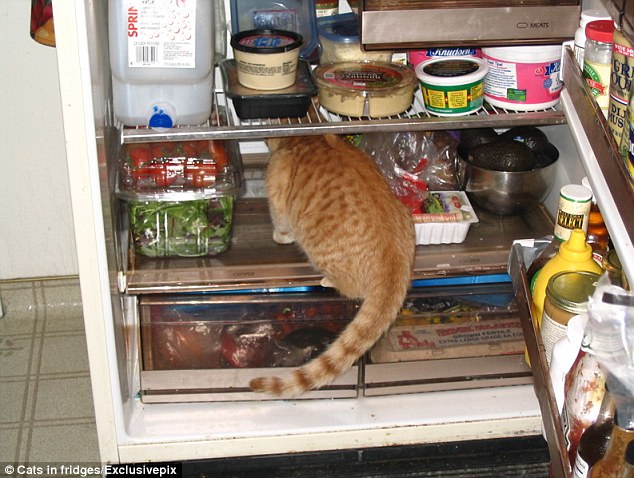
Locate an element on the screen. floor is located at coordinates (61, 425).